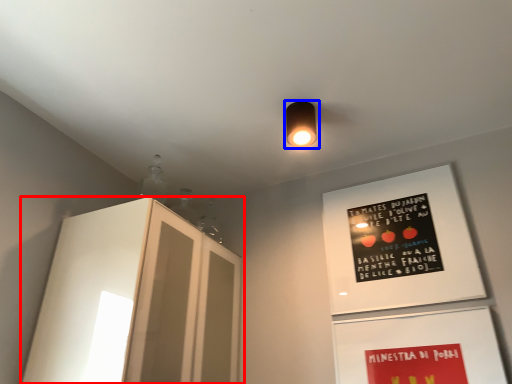
Question: Which object is closer to the camera taking this photo, cabinetry (highlighted by a red box) or lamp (highlighted by a blue box)?

Choices:
 (A) cabinetry
 (B) lamp

Answer: (A)